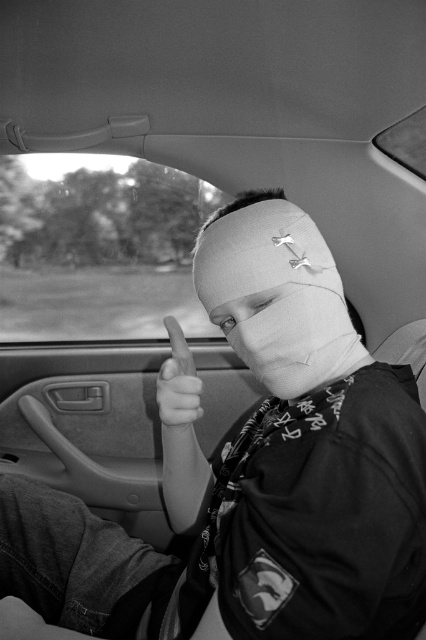
Is the position of white bandage at center more distant than that of smooth white bandage at center?

No, it is in front of smooth white bandage at center.

Is white bandage at center positioned before smooth white bandage at center?

Yes, white bandage at center is closer to the viewer.

Describe the element at coordinates (276, 294) in the screenshot. I see `white bandage at center` at that location.

Locate an element on the screen. white bandage at center is located at coordinates (276, 294).

Can you confirm if transparent glass car window at upper center is smaller than smooth white bandage at center?

Actually, transparent glass car window at upper center might be larger than smooth white bandage at center.

Does transparent glass car window at upper center have a lesser height compared to smooth white bandage at center?

In fact, transparent glass car window at upper center may be taller than smooth white bandage at center.

Is point (115, 205) positioned behind point (224, 312)?

Yes, point (115, 205) is behind point (224, 312).

You are a GUI agent. You are given a task and a screenshot of the screen. Output one action in this format:
    pyautogui.click(x=<x>, y=<y>)
    Task: Click on the transparent glass car window at upper center
    The height and width of the screenshot is (640, 426).
    Given the screenshot: What is the action you would take?
    pyautogui.click(x=97, y=248)

Who is higher up, transparent glass car window at upper center or white bandage at center?

transparent glass car window at upper center is higher up.

Which is more to the right, transparent glass car window at upper center or white bandage at center?

white bandage at center is more to the right.

Is point (48, 292) positioned after point (201, 262)?

That is True.

Locate an element on the screen. The image size is (426, 640). transparent glass car window at upper center is located at coordinates (97, 248).